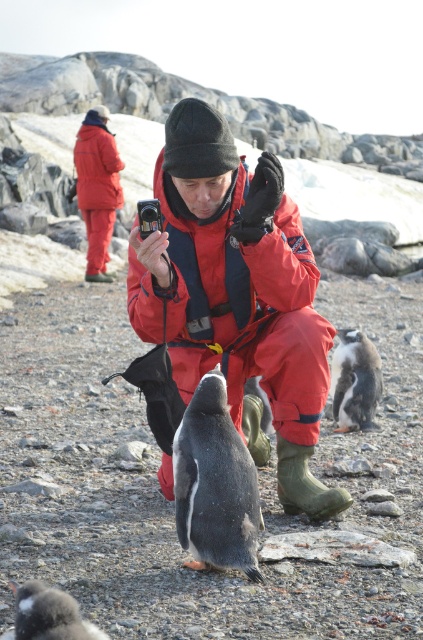
You are a photographer trying to capture a clear shot of the black glossy penguin at center. However, the matte red jacket at center is blocking your view. Can you move the jacket to the side to get an unobstructed view of the penguin?

The matte red jacket at center is positioned over the black glossy penguin at center, so moving the jacket to the side would allow you to see the penguin clearly.

You are a photographer trying to capture a closeup shot of the black glossy penguin at center. You are currently holding the matte red jacket at center. Which direction should you move to get a better angle?

The matte red jacket at center is positioned on the left side of the black glossy penguin at center. To get a better angle, you should move to the right side of the penguin.